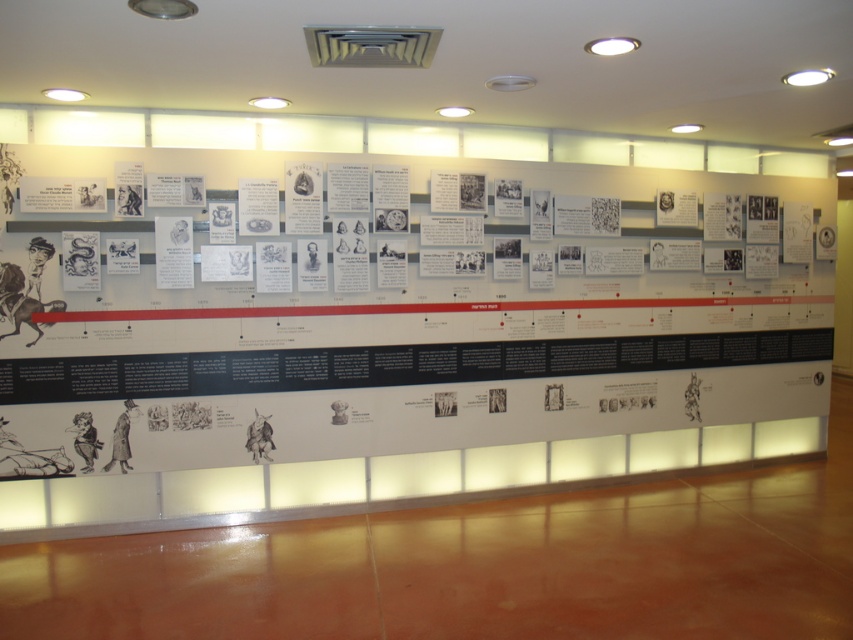
Between white paper poster at center and white paper poster at left, which one appears on the left side from the viewer's perspective?

white paper poster at left is more to the left.

Is point (175, 333) positioned behind point (94, 205)?

Yes, it is.

At what (x,y) coordinates should I click in order to perform the action: click on white paper poster at center. Please return your answer as a coordinate pair (x, y). This screenshot has height=640, width=853. Looking at the image, I should click on (393, 316).